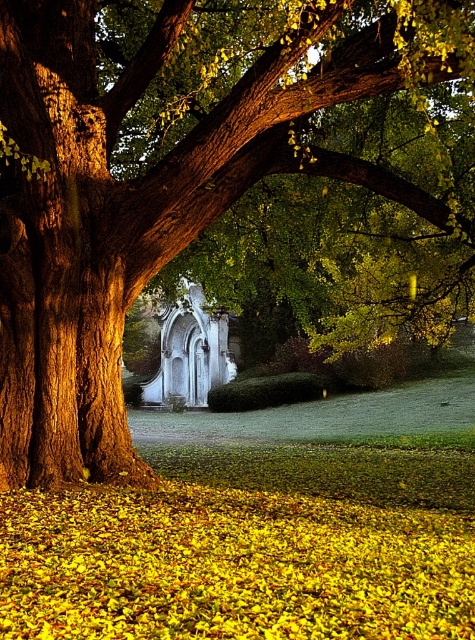
You are standing in the autumn scene and want to take a photo of the white stone chapel at center without the yellow leaf litter at ground blocking the view. Is it possible to do so by adjusting your camera angle?

The yellow leaf litter at ground is shorter than the white stone chapel at center, so yes, you can adjust your camera angle to position the camera higher to avoid the leaves blocking the view of the chapel.

You are standing at the center of the image and want to place a small garden ornament exactly at the location marked by the yellow leaf litter at ground. What are the coordinates where you should place it?

The coordinates for the yellow leaf litter at ground are at point (229, 566), so you should place the garden ornament there.